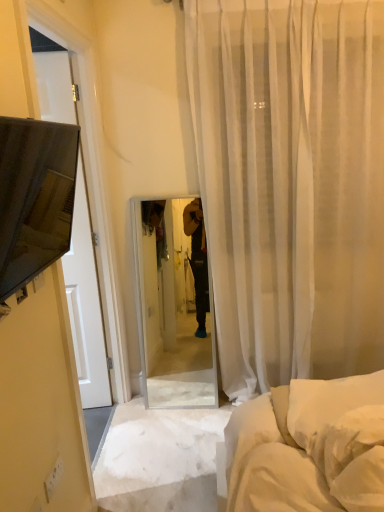
Question: Is white soft pillow at lower right turned away from matte black tv at left?

Choices:
 (A) no
 (B) yes

Answer: (A)

Question: Is white soft pillow at lower right facing towards matte black tv at left?

Choices:
 (A) yes
 (B) no

Answer: (B)

Question: Is white soft pillow at lower right to the left of matte black tv at left from the viewer's perspective?

Choices:
 (A) yes
 (B) no

Answer: (B)

Question: Is the position of white soft pillow at lower right more distant than that of matte black tv at left?

Choices:
 (A) no
 (B) yes

Answer: (B)

Question: From the image's perspective, would you say white soft pillow at lower right is shown under matte black tv at left?

Choices:
 (A) yes
 (B) no

Answer: (A)

Question: Visually, is sheer white curtain at center positioned to the left or to the right of white soft pillow at lower right?

Choices:
 (A) left
 (B) right

Answer: (B)

Question: Choose the correct answer: Is sheer white curtain at center inside white soft pillow at lower right or outside it?

Choices:
 (A) inside
 (B) outside

Answer: (B)

Question: From the image's perspective, relative to white soft pillow at lower right, is sheer white curtain at center above or below?

Choices:
 (A) above
 (B) below

Answer: (A)

Question: From their relative heights in the image, would you say sheer white curtain at center is taller or shorter than white soft pillow at lower right?

Choices:
 (A) tall
 (B) short

Answer: (A)

Question: Is point (379, 394) positioned closer to the camera than point (67, 129)?

Choices:
 (A) farther
 (B) closer

Answer: (A)

Question: From a real-world perspective, is white soft pillow at lower right above or below matte black tv at left?

Choices:
 (A) below
 (B) above

Answer: (A)

Question: Do you think white soft pillow at lower right is within matte black tv at left, or outside of it?

Choices:
 (A) outside
 (B) inside

Answer: (A)

Question: Considering the relative positions of white soft pillow at lower right and matte black tv at left in the image provided, is white soft pillow at lower right to the left or to the right of matte black tv at left?

Choices:
 (A) left
 (B) right

Answer: (B)

Question: From a real-world perspective, is sheer white curtain at center physically located above or below matte black tv at left?

Choices:
 (A) above
 (B) below

Answer: (B)

Question: From the image's perspective, is sheer white curtain at center above or below matte black tv at left?

Choices:
 (A) above
 (B) below

Answer: (A)